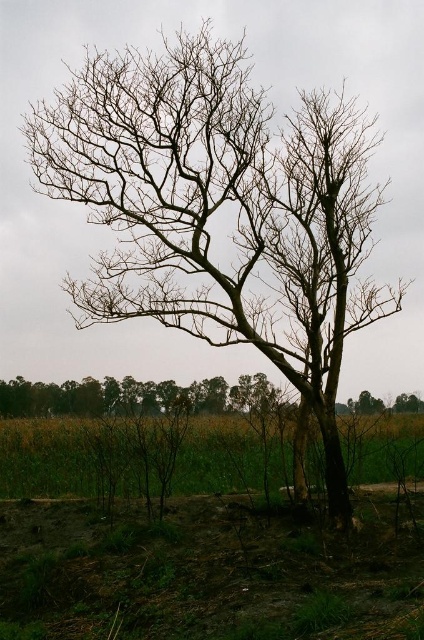
Between green grass at lower center and brown leafless tree at center, which one has less height?

Standing shorter between the two is green grass at lower center.

Which is behind, point (368, 429) or point (125, 390)?

The point (368, 429) is more distant.

Image resolution: width=424 pixels, height=640 pixels. What do you see at coordinates (50, 458) in the screenshot? I see `green grass at lower center` at bounding box center [50, 458].

Identify the location of green grass at lower center. point(50,458).